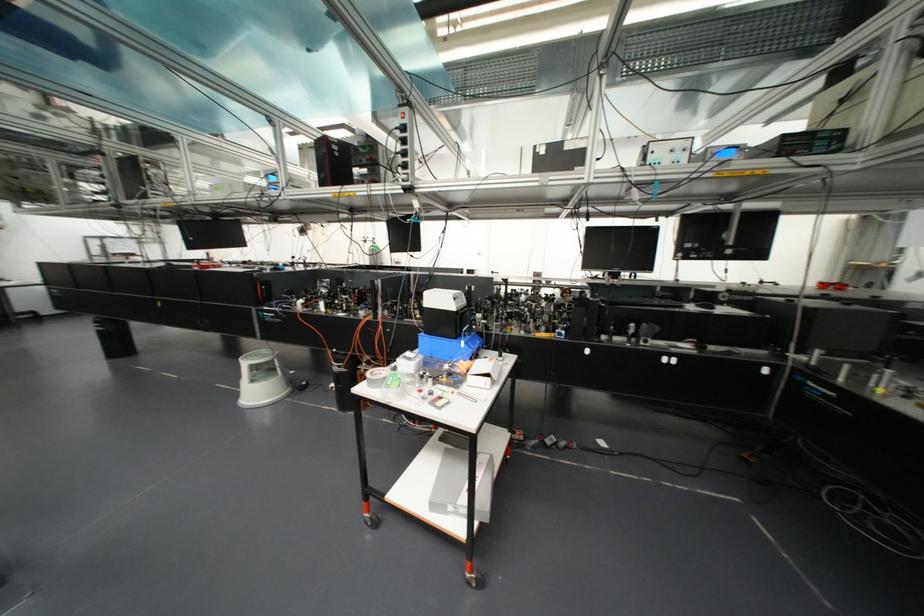
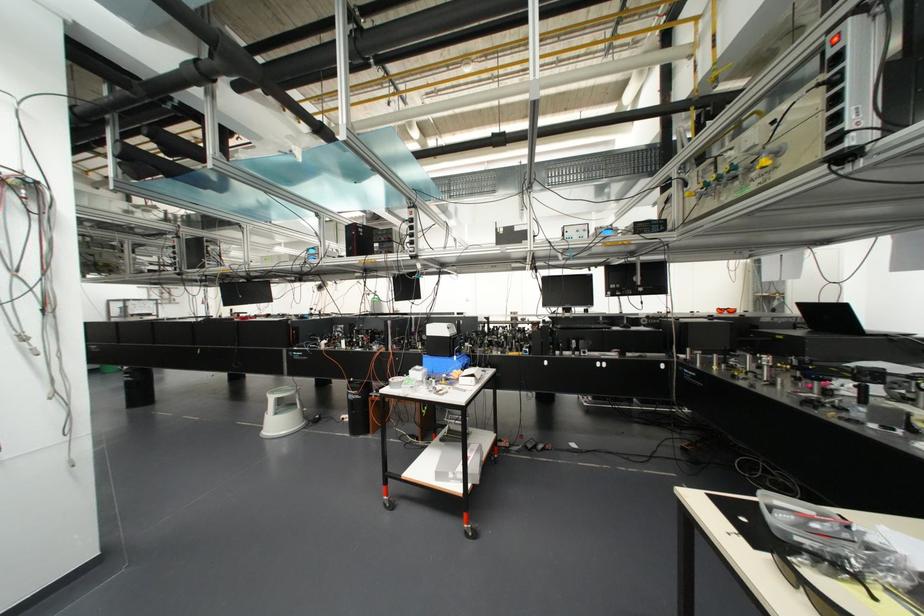
Question: Which direction would the cameraman need to move to produce the second image? Reply with the corresponding letter.

Choices:
 (A) Left
 (B) Right
 (C) Forward
 (D) Backward

Answer: (D)